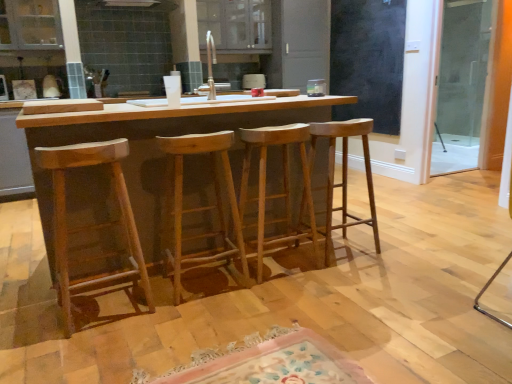
Locate an element on the screen. This screenshot has width=512, height=384. vacant area that is situated to the right of natural wood stool at center, placed as the 2th stool when sorted from left to right is located at coordinates (270, 297).